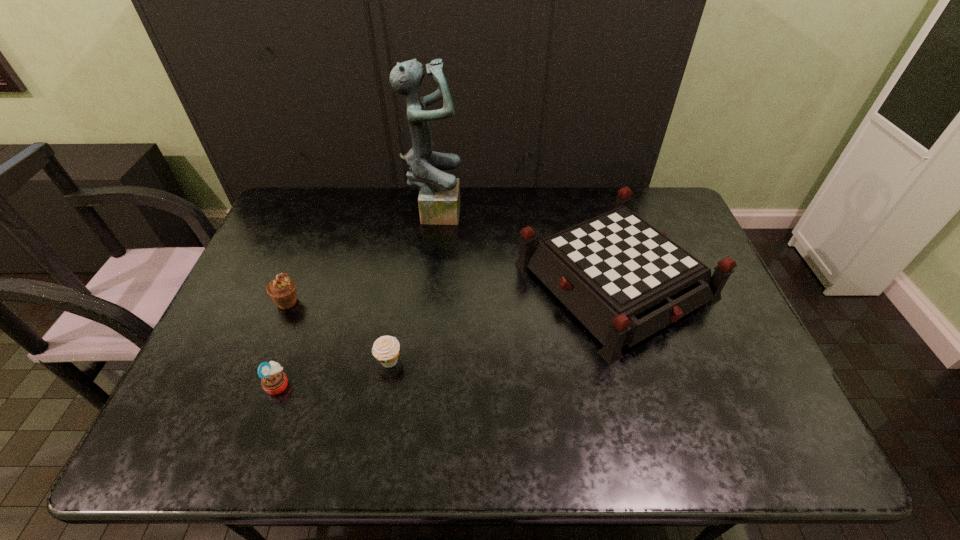
You are a GUI agent. You are given a task and a screenshot of the screen. Output one action in this format:
    pyautogui.click(x=<x>, y=<y>)
    Task: Click on the empty space that is in between the rightmost muffin and the farthest muffin
    
    Given the screenshot: What is the action you would take?
    pyautogui.click(x=339, y=332)

Where is `free point between the nearest object and the rightmost muffin`? The width and height of the screenshot is (960, 540). free point between the nearest object and the rightmost muffin is located at coordinates (334, 373).

Where is `empty location between the second farthest muffin and the tallest object`? The width and height of the screenshot is (960, 540). empty location between the second farthest muffin and the tallest object is located at coordinates (412, 286).

This screenshot has height=540, width=960. Identify the location of empty space between the rightmost muffin and the nearest object. (334, 373).

What are the coordinates of `unoccupied position between the farthest muffin and the fourth shortest object` in the screenshot? It's located at (451, 291).

I want to click on vacant space that is in between the farthest muffin and the nearest muffin, so click(283, 343).

At what (x,y) coordinates should I click in order to perform the action: click on vacant area between the farthest muffin and the rightmost muffin. Please return your answer as a coordinate pair (x, y). The width and height of the screenshot is (960, 540). Looking at the image, I should click on (339, 332).

I want to click on free space between the tallest object and the nearest object, so click(x=356, y=297).

Locate an element on the screen. This screenshot has width=960, height=540. free space between the nearest object and the tallest object is located at coordinates (356, 297).

At what (x,y) coordinates should I click in order to perform the action: click on blank region between the second farthest muffin and the nearest muffin. Please return your answer as a coordinate pair (x, y). The height and width of the screenshot is (540, 960). Looking at the image, I should click on (334, 373).